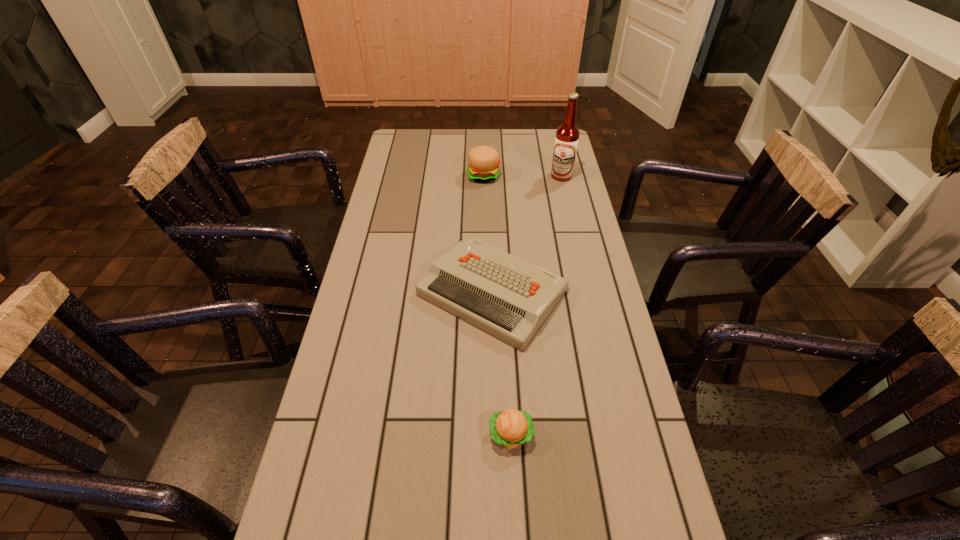
Where is `free space that is in between the computer keyboard and the farther hamburger`? The image size is (960, 540). free space that is in between the computer keyboard and the farther hamburger is located at coordinates (488, 234).

At what (x,y) coordinates should I click in order to perform the action: click on object that is the third closest to the farther hamburger. Please return your answer as a coordinate pair (x, y). The height and width of the screenshot is (540, 960). Looking at the image, I should click on point(511,428).

Identify the location of object that can be found as the third closest to the third shortest object. This screenshot has width=960, height=540. (511, 428).